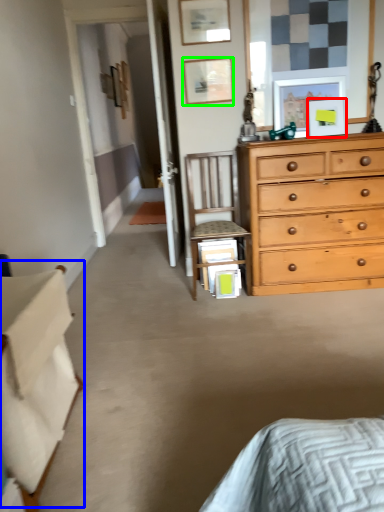
Question: Which is farther away from picture frame (highlighted by a red box)? table (highlighted by a blue box) or picture frame (highlighted by a green box)?

Choices:
 (A) table
 (B) picture frame

Answer: (A)